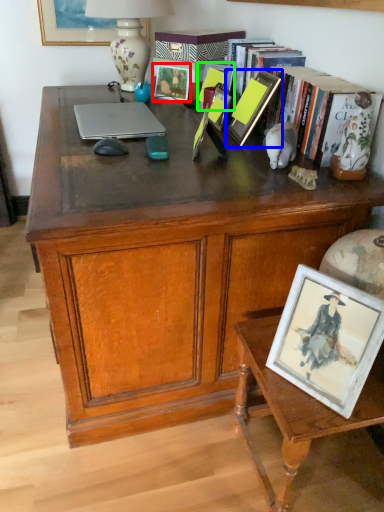
Question: Considering the real-world distances, which object is farthest from picture frame (highlighted by a red box)? picture frame (highlighted by a blue box) or picture frame (highlighted by a green box)?

Choices:
 (A) picture frame
 (B) picture frame

Answer: (A)